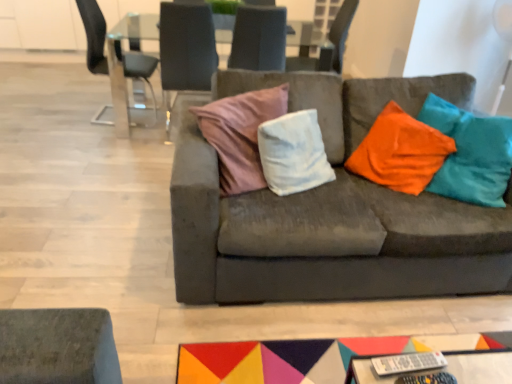
You are a GUI agent. You are given a task and a screenshot of the screen. Output one action in this format:
    pyautogui.click(x=<x>, y=<y>)
    Task: Click on the vacant space in front of velvet cushion at center, the third chair when ordered from right to left
    The image size is (512, 384).
    Given the screenshot: What is the action you would take?
    pyautogui.click(x=145, y=155)